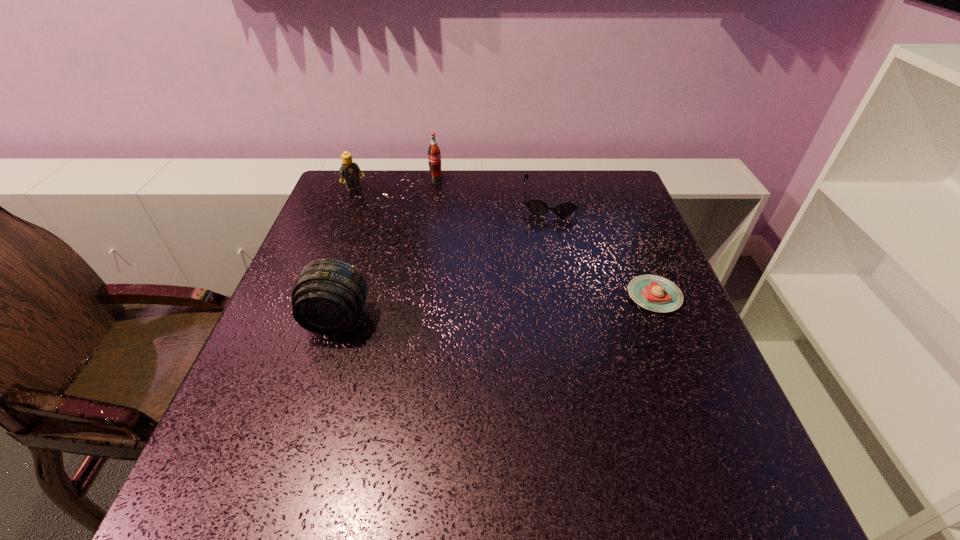
You are a GUI agent. You are given a task and a screenshot of the screen. Output one action in this format:
    pyautogui.click(x=<x>, y=<y>)
    Task: Click on the vacant area at the left edge
    
    Given the screenshot: What is the action you would take?
    pyautogui.click(x=270, y=321)

Identify the location of vacant space at the right edge of the desktop. (645, 244).

In the image, there is a desktop. Identify the location of vacant space at the far left corner. (368, 186).

In the image, there is a desktop. At what (x,y) coordinates should I click in order to perform the action: click on free space at the near left corner. Please return your answer as a coordinate pair (x, y). The image size is (960, 540). Looking at the image, I should click on (270, 421).

In the image, there is a desktop. Identify the location of free space at the far right corner. This screenshot has width=960, height=540. (617, 192).

The image size is (960, 540). In order to click on free space between the rightmost object and the fourth object from left to right in this screenshot , I will do [603, 248].

The height and width of the screenshot is (540, 960). In order to click on free space between the telephoto lens and the soda bottle in this screenshot , I will do `click(387, 251)`.

The image size is (960, 540). Identify the location of free space between the rightmost object and the third shortest object. (505, 242).

Find the location of a particular element. This screenshot has height=540, width=960. vacant space in between the third shortest object and the telephoto lens is located at coordinates (346, 255).

Image resolution: width=960 pixels, height=540 pixels. What are the coordinates of `free space between the telephoto lens and the rightmost object` in the screenshot? It's located at (495, 308).